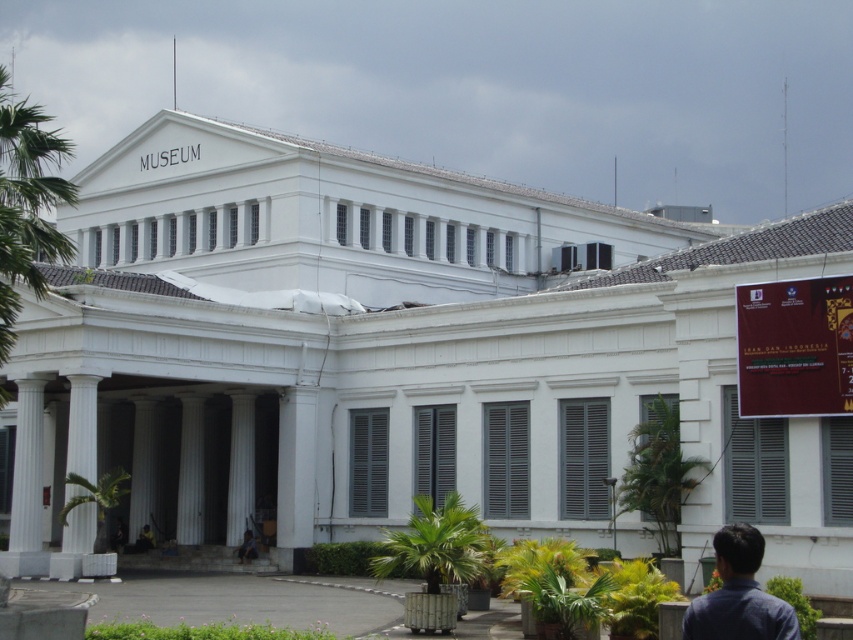
You are an architect designing a new pathway between the green leafy palm tree at left and the green leafy palm tree at lower left. How far apart are these two palm trees to ensure the pathway is appropriately sized?

The green leafy palm tree at left is 58.45 feet from the green leafy palm tree at lower left, so the pathway should be designed to accommodate this distance.

You are standing in front of the MUSEUM and notice two green leafy palm trees. One is labeled as the green leafy palm tree at left and the other as the green leafy palm tree at lower left. Which one is positioned higher up in the image?

The green leafy palm tree at left is positioned higher up in the image compared to the green leafy palm tree at lower left.

You are a visitor standing in front of the MUSEUM. You notice the green leafy palm tree at center and the blue denim shirt at lower right. Which object is closer to you?

The blue denim shirt at lower right is closer to you because it is larger in size compared to the green leafy palm tree at center, which is smaller.